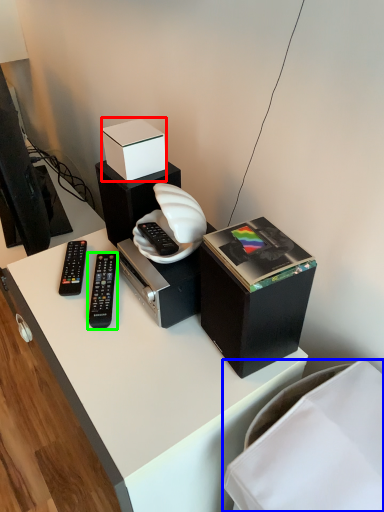
Question: Based on their relative distances, which object is farther from box (highlighted by a red box)? Choose from furniture (highlighted by a blue box) and remote control (highlighted by a green box).

Choices:
 (A) furniture
 (B) remote control

Answer: (A)